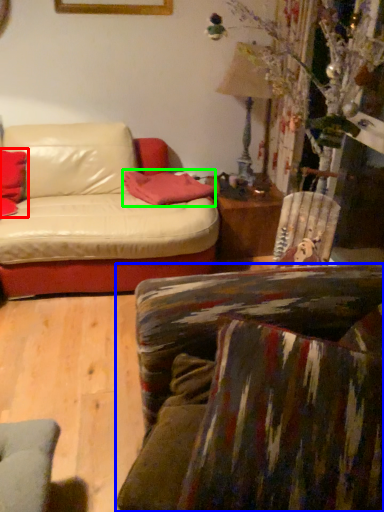
Question: Which is nearer to the pillow (highlighted by a red box)? studio couch (highlighted by a blue box) or pillow (highlighted by a green box).

Choices:
 (A) studio couch
 (B) pillow

Answer: (B)